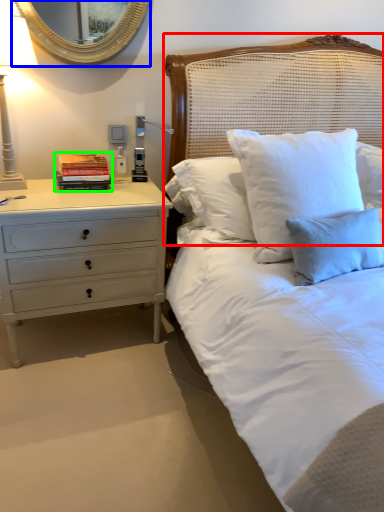
Question: Based on their relative distances, which object is nearer to headboard (highlighted by a red box)? Choose from mirror (highlighted by a blue box) and book (highlighted by a green box).

Choices:
 (A) mirror
 (B) book

Answer: (A)